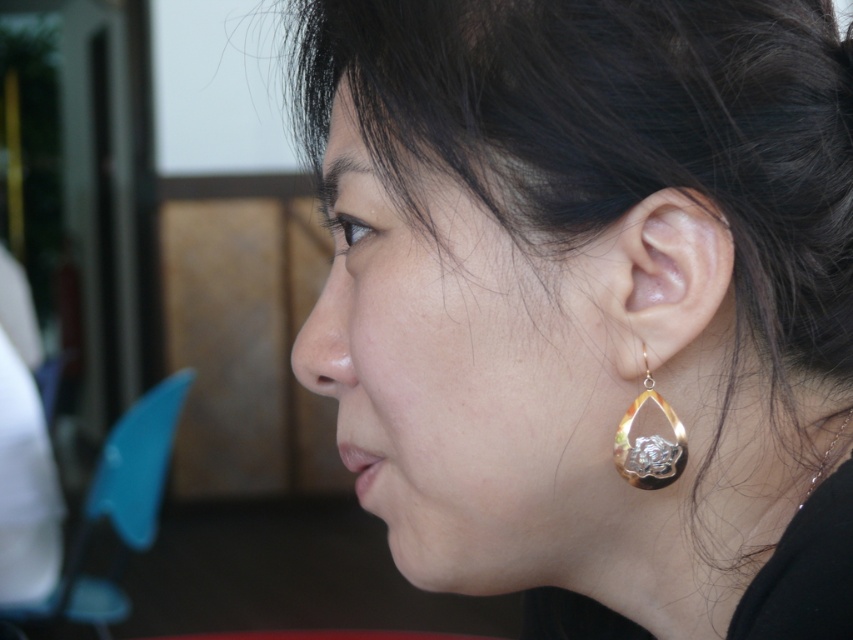
Who is higher up, gold/textured earring at right or gold/textured metal teardrop-shaped earring at ear?

gold/textured earring at right is higher up.

Consider the image. Is the position of gold/textured earring at right less distant than that of gold/textured metal teardrop-shaped earring at ear?

Yes, it is in front of gold/textured metal teardrop-shaped earring at ear.

What do you see at coordinates (657, 278) in the screenshot? I see `gold/textured earring at right` at bounding box center [657, 278].

Locate an element on the screen. The image size is (853, 640). gold/textured earring at right is located at coordinates (657, 278).

Could you measure the distance between gold metallic earrings at right and gold/textured metal teardrop-shaped earring at ear?

9.62 centimeters

Which is behind, point (428, 570) or point (662, 445)?

The point (428, 570) is more distant.

Between point (480, 252) and point (647, 442), which one is positioned behind?

The point (647, 442) is more distant.

At what (x,y) coordinates should I click in order to perform the action: click on gold metallic earrings at right. Please return your answer as a coordinate pair (x, y). Looking at the image, I should click on 590,300.

Which of these two, gold metallic earrings at right or gold/textured earring at right, stands taller?

Standing taller between the two is gold metallic earrings at right.

Which is above, gold metallic earrings at right or gold/textured earring at right?

gold metallic earrings at right is above.

This screenshot has height=640, width=853. Describe the element at coordinates (590, 300) in the screenshot. I see `gold metallic earrings at right` at that location.

This screenshot has width=853, height=640. Find the location of `gold metallic earrings at right`. gold metallic earrings at right is located at coordinates (590, 300).